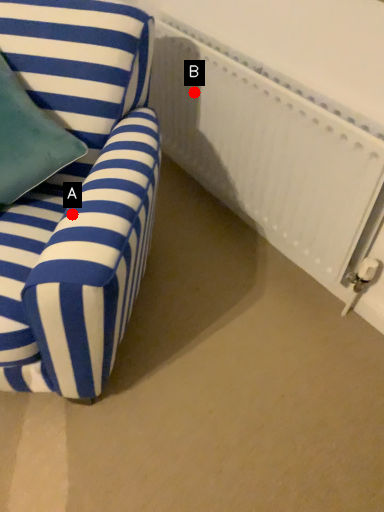
Question: Two points are circled on the image, labeled by A and B beside each circle. Among these points, which one is farthest from the camera?

Choices:
 (A) A is further
 (B) B is further

Answer: (B)